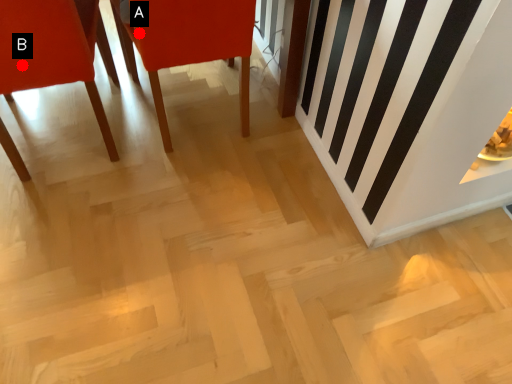
Question: Two points are circled on the image, labeled by A and B beside each circle. Which point is closer to the camera?

Choices:
 (A) A is closer
 (B) B is closer

Answer: (B)